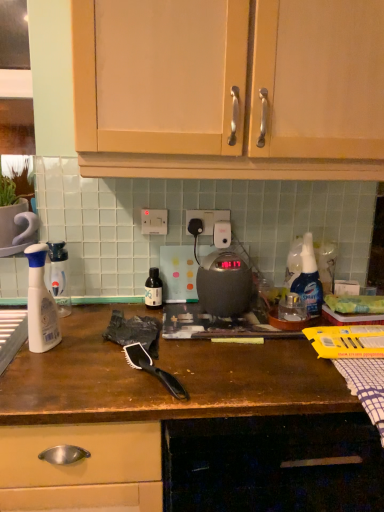
Question: Does white plastic electric outlet at center, the first electric outlet when ordered from right to left, lie behind brown matte countertop at center, which appears as the second cabinetry when viewed from the top?

Choices:
 (A) yes
 (B) no

Answer: (A)

Question: Can you confirm if white plastic electric outlet at center, the first electric outlet when ordered from right to left, is wider than brown matte countertop at center, the 1th cabinetry ordered from the bottom?

Choices:
 (A) no
 (B) yes

Answer: (A)

Question: Is white plastic electric outlet at center, arranged as the 2th electric outlet when viewed from the left, facing away from brown matte countertop at center, which appears as the second cabinetry when viewed from the top?

Choices:
 (A) yes
 (B) no

Answer: (B)

Question: Can you confirm if white plastic electric outlet at center, the first electric outlet when ordered from right to left, is bigger than brown matte countertop at center, the 1th cabinetry ordered from the bottom?

Choices:
 (A) no
 (B) yes

Answer: (A)

Question: Is white plastic electric outlet at center, arranged as the 2th electric outlet when viewed from the left, at the left side of brown matte countertop at center, which appears as the second cabinetry when viewed from the top?

Choices:
 (A) yes
 (B) no

Answer: (B)

Question: Based on their positions, is brown matte countertop at center, the 1th cabinetry ordered from the bottom, located to the left or right of translucent plastic spray bottle at left?

Choices:
 (A) right
 (B) left

Answer: (A)

Question: Is brown matte countertop at center, the 1th cabinetry ordered from the bottom, wider or thinner than translucent plastic spray bottle at left?

Choices:
 (A) wide
 (B) thin

Answer: (A)

Question: Looking at the image, does brown matte countertop at center, which appears as the second cabinetry when viewed from the top, seem bigger or smaller compared to translucent plastic spray bottle at left?

Choices:
 (A) small
 (B) big

Answer: (B)

Question: From a real-world perspective, is brown matte countertop at center, the 1th cabinetry ordered from the bottom, above or below translucent plastic spray bottle at left?

Choices:
 (A) below
 (B) above

Answer: (A)

Question: In the image, is matte black bottle at center, which ranks as the 1th bottle in right-to-left order, positioned in front of or behind white plastic electric outlet at center, the first electric outlet when ordered from right to left?

Choices:
 (A) behind
 (B) front

Answer: (B)

Question: Is matte black bottle at center, which ranks as the 1th bottle in right-to-left order, inside or outside of white plastic electric outlet at center, the first electric outlet when ordered from right to left?

Choices:
 (A) inside
 (B) outside

Answer: (B)

Question: Looking at their shapes, would you say matte black bottle at center, which ranks as the 1th bottle in right-to-left order, is wider or thinner than white plastic electric outlet at center, the first electric outlet when ordered from right to left?

Choices:
 (A) thin
 (B) wide

Answer: (B)

Question: In terms of size, does matte black bottle at center, which is counted as the 2th bottle, starting from the left, appear bigger or smaller than white plastic electric outlet at center, arranged as the 2th electric outlet when viewed from the left?

Choices:
 (A) big
 (B) small

Answer: (A)

Question: Is white plastic electric outlet at center, the 2th electric outlet viewed from the right, taller or shorter than matte black kettle at center?

Choices:
 (A) tall
 (B) short

Answer: (B)

Question: From a real-world perspective, relative to matte black kettle at center, is white plastic electric outlet at center, the 2th electric outlet viewed from the right, vertically above or below?

Choices:
 (A) below
 (B) above

Answer: (B)